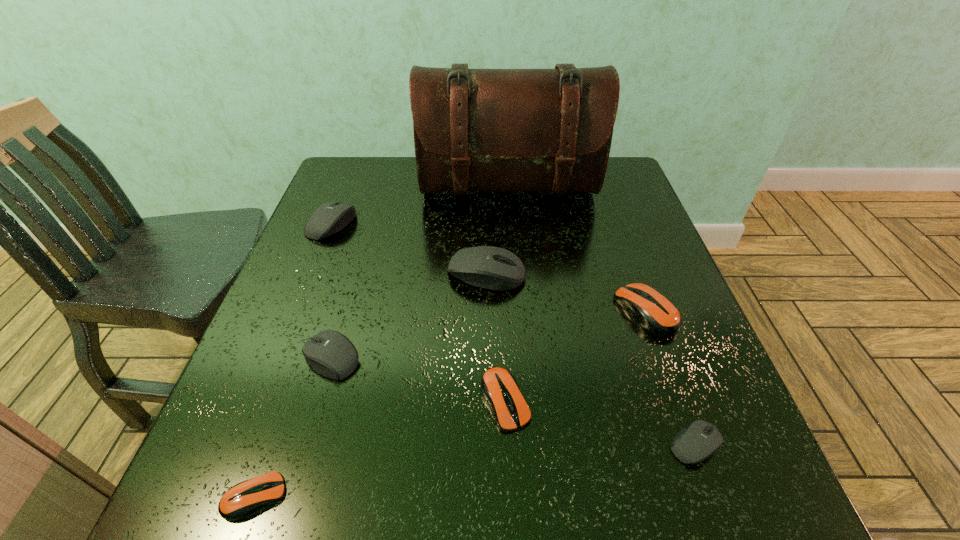
Find the location of a particular element. The height and width of the screenshot is (540, 960). the second nearest orange computer mouse is located at coordinates (500, 389).

You are a GUI agent. You are given a task and a screenshot of the screen. Output one action in this format:
    pyautogui.click(x=<x>, y=<y>)
    Task: Click on the nearest black computer equipment
    This screenshot has width=960, height=540.
    Given the screenshot: What is the action you would take?
    pyautogui.click(x=700, y=440)

Locate an element on the screen. This screenshot has height=540, width=960. the smallest black computer equipment is located at coordinates (700, 440).

The width and height of the screenshot is (960, 540). I want to click on the nearest computer mouse, so click(244, 498).

Locate an element on the screen. The height and width of the screenshot is (540, 960). the leftmost orange computer mouse is located at coordinates (244, 498).

Where is `vacant space situated 0.240m on the front-facing side of the brown satchel`? This screenshot has width=960, height=540. vacant space situated 0.240m on the front-facing side of the brown satchel is located at coordinates (516, 279).

I want to click on free space located on the right of the third black computer equipment from left to right, so click(x=574, y=273).

Locate an element on the screen. vacant space located on the front of the farthest black computer equipment is located at coordinates (270, 377).

Locate an element on the screen. free space located 0.060m on the back of the biggest orange computer mouse is located at coordinates (630, 268).

Find the location of a particular element. vacant area situated on the back of the third farthest black computer equipment is located at coordinates (369, 231).